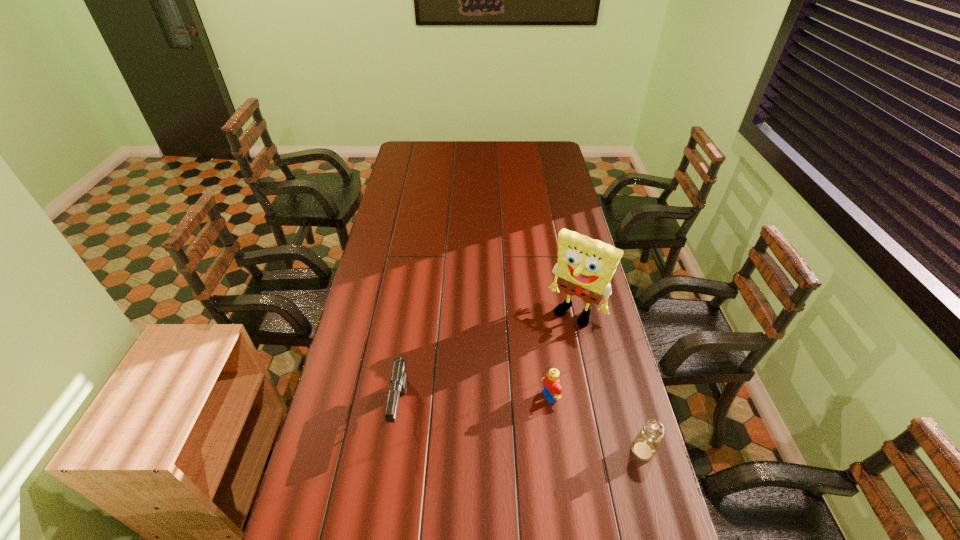
Locate an element on the screen. This screenshot has width=960, height=540. vacant space located on the face of the tallest object is located at coordinates (510, 401).

The height and width of the screenshot is (540, 960). Identify the location of vacant space located 0.180m on the face of the tallest object. (539, 361).

Where is `blank area located on the face of the tallest object`? blank area located on the face of the tallest object is located at coordinates (518, 389).

The height and width of the screenshot is (540, 960). Find the location of `saltshaker present at the right edge`. saltshaker present at the right edge is located at coordinates (645, 445).

Locate an element on the screen. This screenshot has width=960, height=540. sponge situated at the right edge is located at coordinates (585, 267).

Where is `free space at the far edge of the desktop`? Image resolution: width=960 pixels, height=540 pixels. free space at the far edge of the desktop is located at coordinates (490, 159).

At what (x,y) coordinates should I click in order to perform the action: click on free space at the near edge of the desktop. Please return your answer as a coordinate pair (x, y). Looking at the image, I should click on (374, 511).

In the image, there is a desktop. Where is `vacant space at the left edge`? Image resolution: width=960 pixels, height=540 pixels. vacant space at the left edge is located at coordinates (392, 321).

This screenshot has height=540, width=960. Identify the location of vacant area at the right edge. (595, 405).

Image resolution: width=960 pixels, height=540 pixels. Find the location of `vacant space at the far left corner`. vacant space at the far left corner is located at coordinates 418,160.